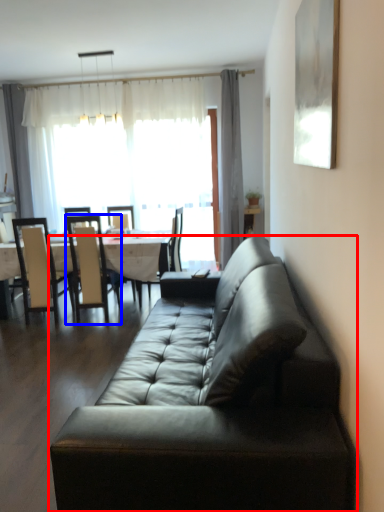
Question: Which object is further to the camera taking this photo, studio couch (highlighted by a red box) or chair (highlighted by a blue box)?

Choices:
 (A) studio couch
 (B) chair

Answer: (B)